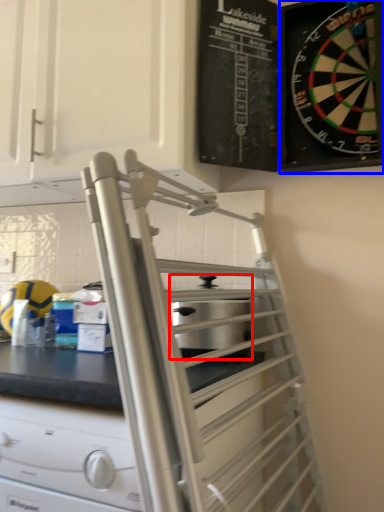
Question: Which point is closer to the camera, appliance (highlighted by a red box) or cabinetry (highlighted by a blue box)?

Choices:
 (A) appliance
 (B) cabinetry

Answer: (B)